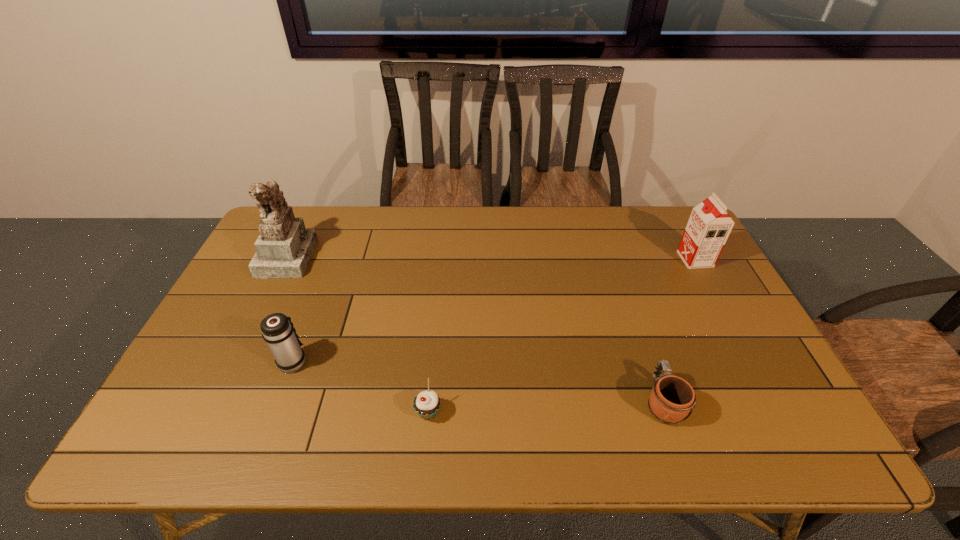
This screenshot has height=540, width=960. In order to click on free space between the cupcake and the mug in this screenshot , I will do `click(545, 407)`.

Identify the location of free space that is in between the tallest object and the second object from left to right. The width and height of the screenshot is (960, 540). (290, 309).

Where is `vacant space that is in between the leftmost object and the fourth object from left to right`? Image resolution: width=960 pixels, height=540 pixels. vacant space that is in between the leftmost object and the fourth object from left to right is located at coordinates (475, 328).

Where is `free space between the third object from left to right and the third shortest object`? free space between the third object from left to right and the third shortest object is located at coordinates (361, 387).

Identify the location of vacant space that's between the thermos bottle and the cupcake. (361, 387).

In order to click on unoccupied position between the rightmost object and the thermos bottle in this screenshot , I will do `click(494, 310)`.

You are a GUI agent. You are given a task and a screenshot of the screen. Output one action in this format:
    pyautogui.click(x=<x>, y=<y>)
    Task: Click on the object that is the second closest to the second tallest object
    The width and height of the screenshot is (960, 540).
    Given the screenshot: What is the action you would take?
    pyautogui.click(x=426, y=404)

Identify the location of object that is the closest to the second object from left to right. (284, 247).

The height and width of the screenshot is (540, 960). I want to click on free spot that satisfies the following two spatial constraints: 1. on the front-facing side of the leftmost object; 2. on the left side of the second tallest object, so click(286, 259).

Identify the location of blank space that satisfies the following two spatial constraints: 1. on the side of the mug with the handle; 2. on the left side of the second tallest object. (614, 259).